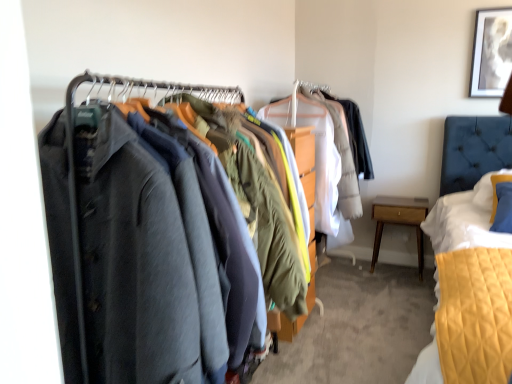
Question: Is matte black coat at left not inside light wood/finely crafted nightstand at lower right?

Choices:
 (A) yes
 (B) no

Answer: (A)

Question: Considering the relative sizes of matte black coat at left and light wood/finely crafted nightstand at lower right in the image provided, is matte black coat at left bigger than light wood/finely crafted nightstand at lower right?

Choices:
 (A) yes
 (B) no

Answer: (A)

Question: Is matte black coat at left facing away from light wood/finely crafted nightstand at lower right?

Choices:
 (A) no
 (B) yes

Answer: (A)

Question: Does matte black coat at left lie behind light wood/finely crafted nightstand at lower right?

Choices:
 (A) no
 (B) yes

Answer: (A)

Question: Does matte black coat at left appear on the right side of light wood/finely crafted nightstand at lower right?

Choices:
 (A) yes
 (B) no

Answer: (B)

Question: From a real-world perspective, does matte black coat at left sit lower than light wood/finely crafted nightstand at lower right?

Choices:
 (A) no
 (B) yes

Answer: (A)

Question: Is white paper at upper right next to light wood/finely crafted nightstand at lower right?

Choices:
 (A) yes
 (B) no

Answer: (B)

Question: Does white paper at upper right lie in front of light wood/finely crafted nightstand at lower right?

Choices:
 (A) no
 (B) yes

Answer: (B)

Question: Is white paper at upper right looking in the opposite direction of light wood/finely crafted nightstand at lower right?

Choices:
 (A) no
 (B) yes

Answer: (A)

Question: Could light wood/finely crafted nightstand at lower right be considered to be inside white paper at upper right?

Choices:
 (A) no
 (B) yes

Answer: (A)

Question: Does white paper at upper right have a lesser height compared to light wood/finely crafted nightstand at lower right?

Choices:
 (A) yes
 (B) no

Answer: (B)

Question: Is white paper at upper right at the left side of light wood/finely crafted nightstand at lower right?

Choices:
 (A) no
 (B) yes

Answer: (A)

Question: Is matte black coat at left directly adjacent to white paper at upper right?

Choices:
 (A) no
 (B) yes

Answer: (A)